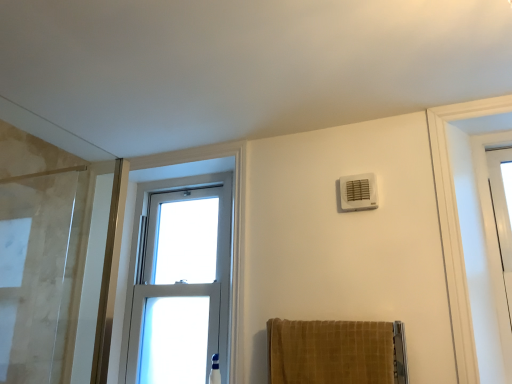
Question: Considering the positions of clear glass window at center and white plastic air conditioning unit at upper right in the image, is clear glass window at center wider or thinner than white plastic air conditioning unit at upper right?

Choices:
 (A) wide
 (B) thin

Answer: (A)

Question: From the image's perspective, is clear glass window at center positioned above or below white plastic air conditioning unit at upper right?

Choices:
 (A) below
 (B) above

Answer: (A)

Question: Which is farther from the clear glass window at center?

Choices:
 (A) velvet gold towel at lower center
 (B) white plastic air conditioning unit at upper right

Answer: (B)

Question: Estimate the real-world distances between objects in this image. Which object is farther from the white plastic air conditioning unit at upper right?

Choices:
 (A) clear glass window at center
 (B) velvet gold towel at lower center

Answer: (A)